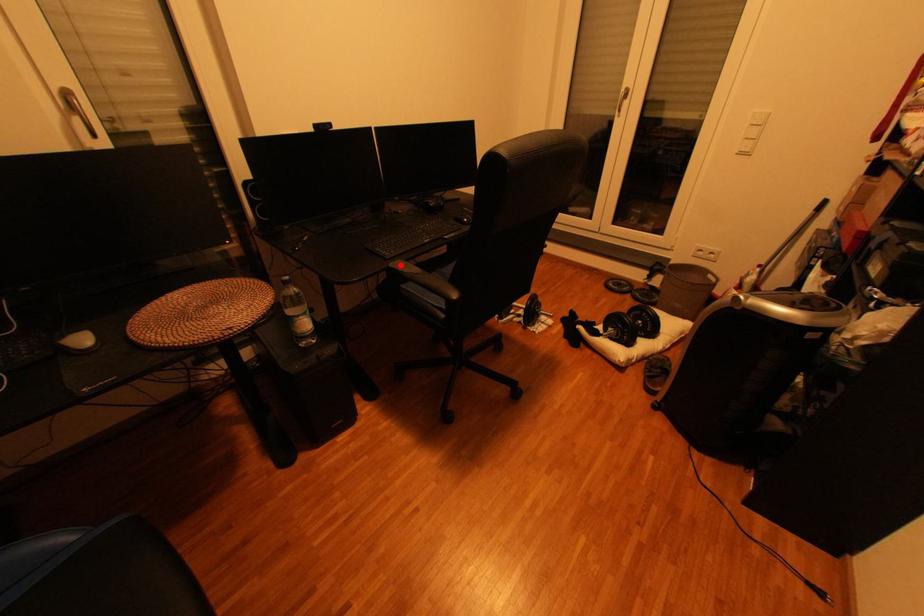
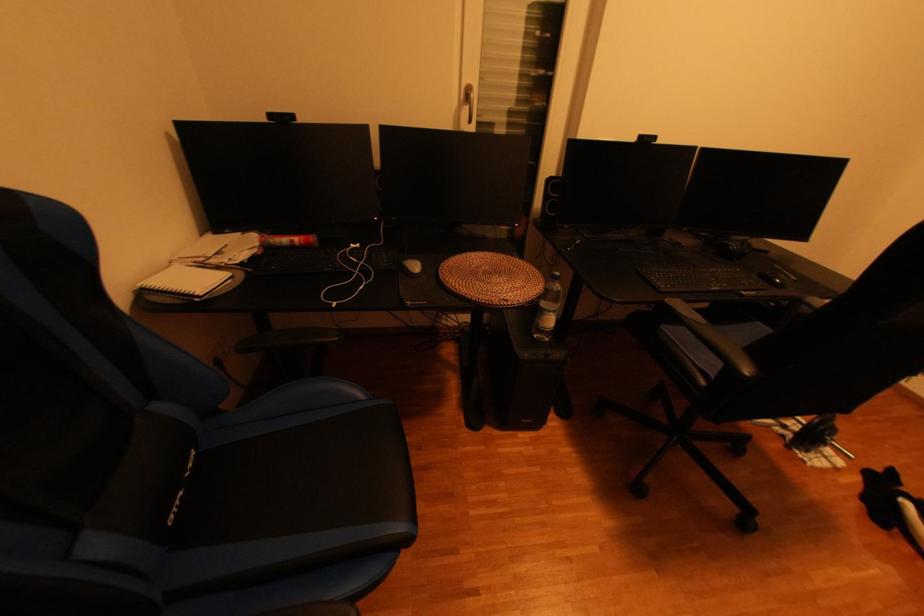
Question: I am providing you with two images of the same scene from different viewpoints. A red point is shown in image1. For the corresponding object point in image2, is it positioned nearer or farther from the camera?

Choices:
 (A) Nearer
 (B) Farther

Answer: (A)